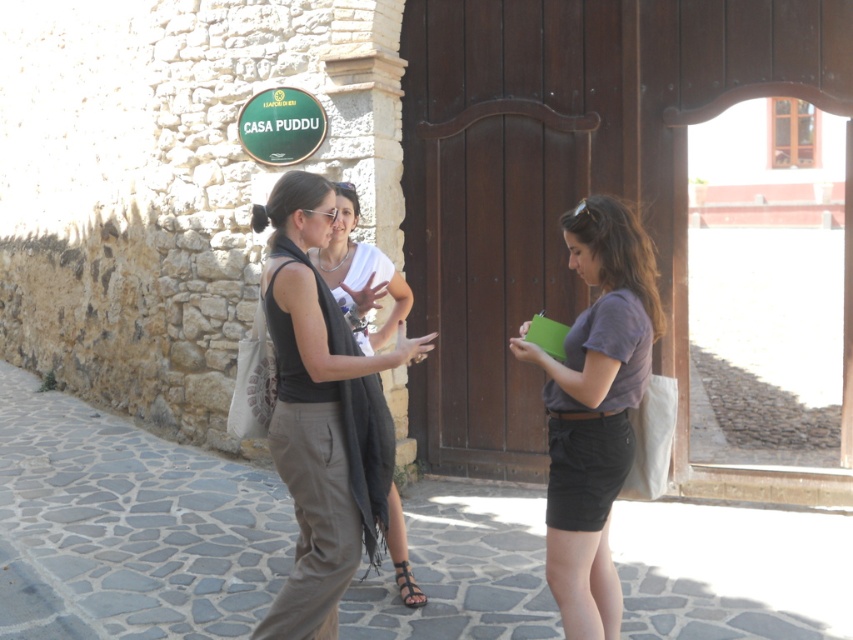
Question: Which object appears closest to the camera in this image?

Choices:
 (A) brown leather sandal at center
 (B) green matte sign at upper center
 (C) purple cotton shirt at center

Answer: (C)

Question: Is dark gray fabric vest at center smaller than purple cotton shirt at center?

Choices:
 (A) yes
 (B) no

Answer: (B)

Question: Does green matte sign at upper center lie in front of brown leather sandal at center?

Choices:
 (A) yes
 (B) no

Answer: (B)

Question: Among these objects, which one is farthest from the camera?

Choices:
 (A) green matte sign at upper center
 (B) purple cotton shirt at center
 (C) brown leather sandal at center
 (D) dark gray fabric vest at center

Answer: (A)

Question: Is purple cotton shirt at center closer to camera compared to brown leather sandal at center?

Choices:
 (A) no
 (B) yes

Answer: (B)

Question: Which is nearer to the purple cotton shirt at center?

Choices:
 (A) green matte sign at upper center
 (B) brown leather sandal at center

Answer: (B)